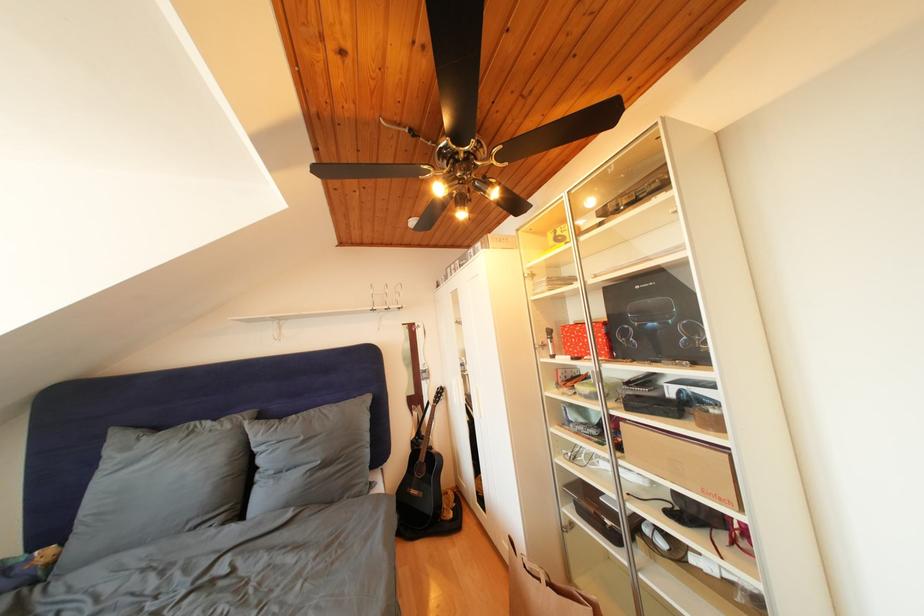
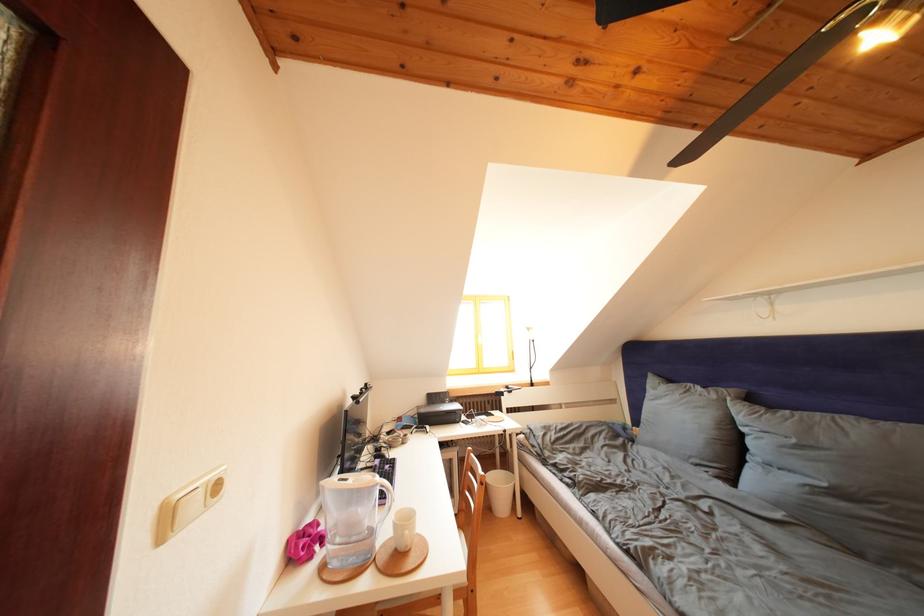
Locate, in the second image, the point that corresponds to [236,432] in the first image.

(722, 402)